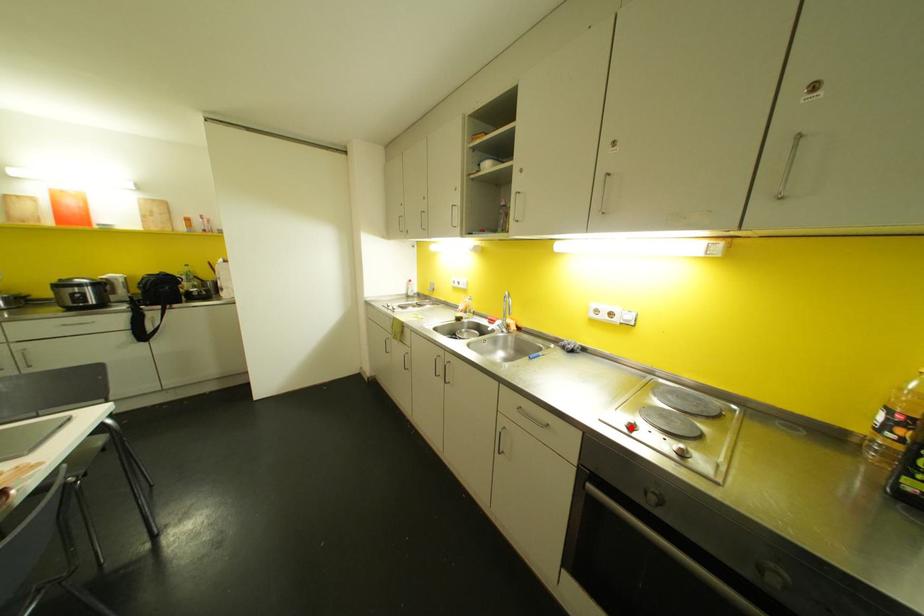
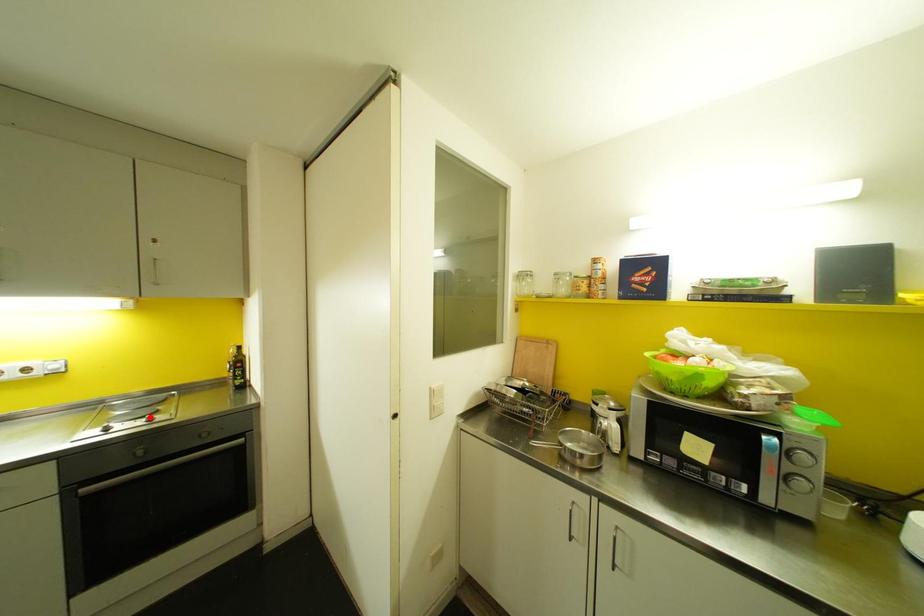
I am providing you with two images of the same scene from different viewpoints. A red point is marked on the first image and another point is marked on the second image. Are the points marked in image1 and image2 representing the same 3D position?

No